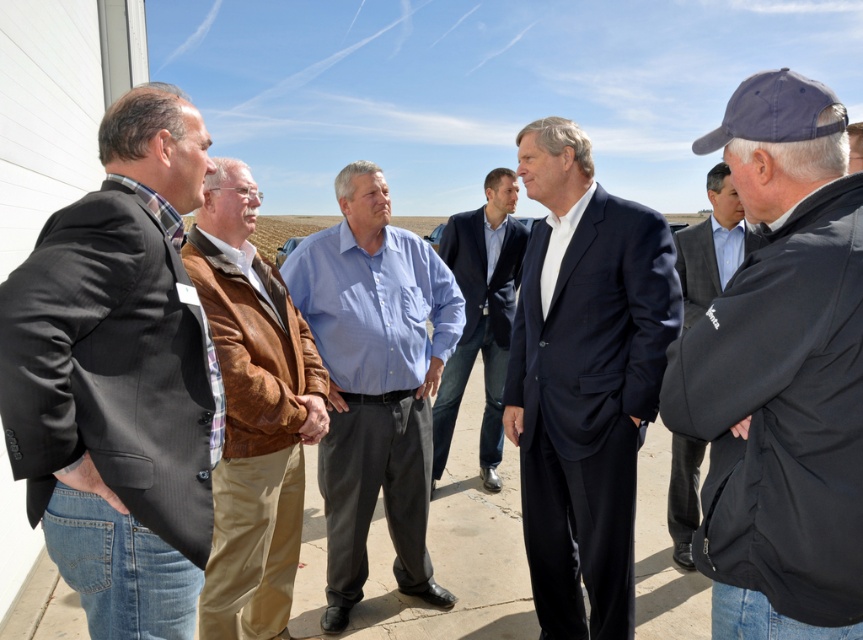
Question: Can you confirm if blue cotton shirt at center is smaller than blue shirt at center?

Choices:
 (A) no
 (B) yes

Answer: (B)

Question: Can you confirm if dark gray pinstripe suit at left is positioned above dark gray jacket at right?

Choices:
 (A) yes
 (B) no

Answer: (B)

Question: Does blue cotton shirt at center come behind brown suede jacket at center?

Choices:
 (A) yes
 (B) no

Answer: (A)

Question: Estimate the real-world distances between objects in this image. Which object is closer to the blue cotton shirt at center?

Choices:
 (A) dark blue suit at center
 (B) dark blue cap at center
 (C) brown suede jacket at center
 (D) blue shirt at center

Answer: (C)

Question: Which point appears farthest from the camera in this image?

Choices:
 (A) (736, 259)
 (B) (464, 376)

Answer: (B)

Question: Which is nearer to the dark gray pinstripe suit at left?

Choices:
 (A) dark blue cap at center
 (B) blue cotton shirt at center
 (C) brown suede jacket at center
 (D) blue shirt at center

Answer: (C)